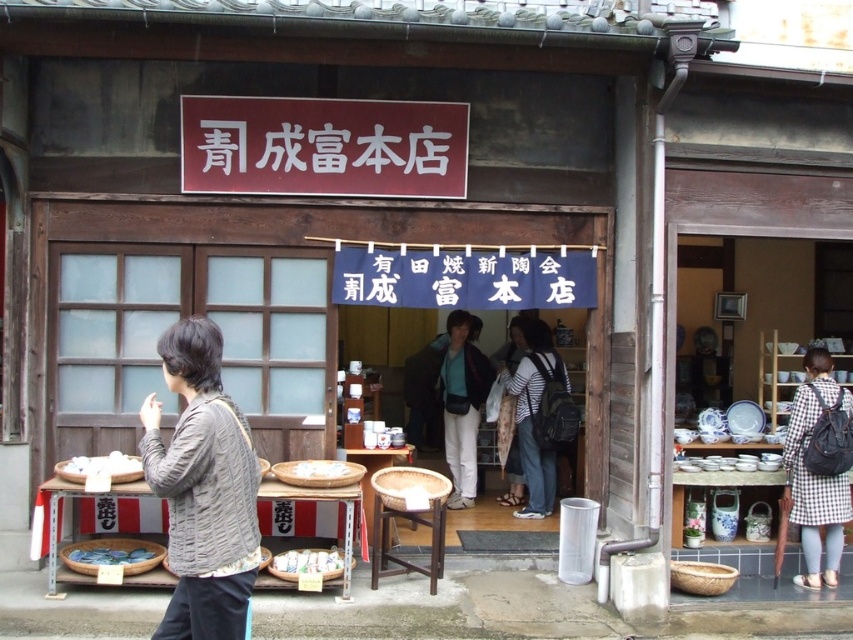
Question: Is whitematerial/texture sign at upper center further to camera compared to blue matte bowl at lower left?

Choices:
 (A) no
 (B) yes

Answer: (B)

Question: Which point is farther to the camera?

Choices:
 (A) (525, 332)
 (B) (437, 164)
 (C) (152, 481)
 (D) (836, 403)

Answer: (A)

Question: Does red matte sign at center appear under white matte bowl at lower left?

Choices:
 (A) no
 (B) yes

Answer: (A)

Question: Can you confirm if knitted gray sweater at left is bigger than white matte bowl at lower left?

Choices:
 (A) no
 (B) yes

Answer: (B)

Question: Which of these objects is positioned farthest from the white glossy plate at lower center?

Choices:
 (A) checkered fabric dress at lower right
 (B) whitematerial/texture sign at upper center
 (C) striped t-shirt at center
 (D) red matte sign at center

Answer: (A)

Question: Which of the following is the closest to the observer?

Choices:
 (A) striped t-shirt at center
 (B) blue matte bowl at lower left
 (C) whitematerial/texture sign at upper center

Answer: (B)